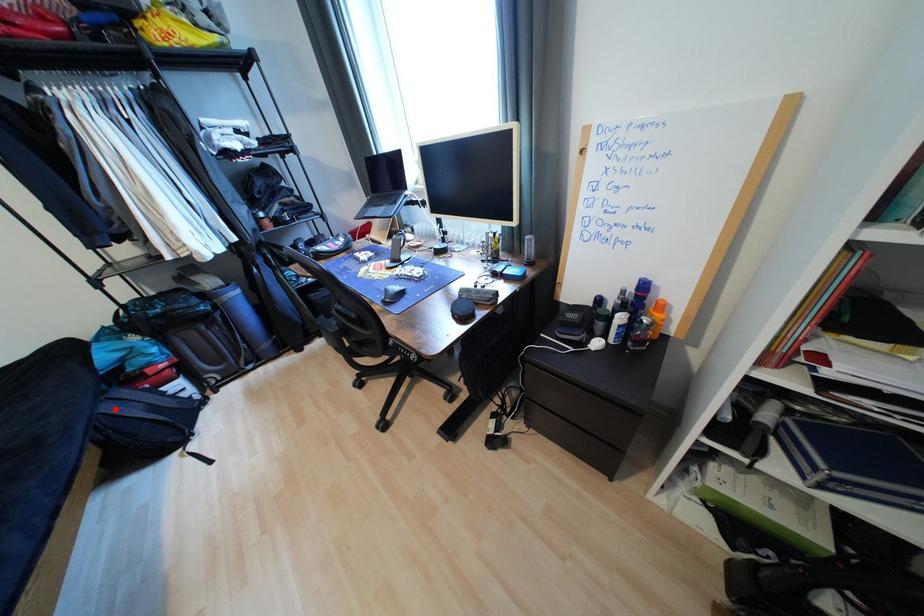
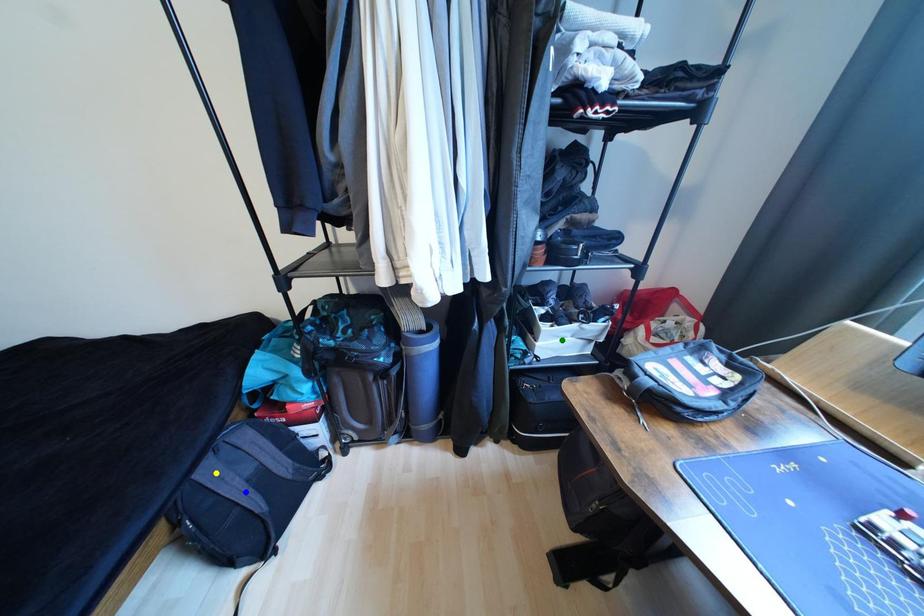
Question: I am providing you with two images of the same scene from different viewpoints. A red point is marked on the first image. You are given multiple points on the second image. Which mark in image 2 goes with the point in image 1?

Choices:
 (A) blue point
 (B) yellow point
 (C) green point

Answer: (B)